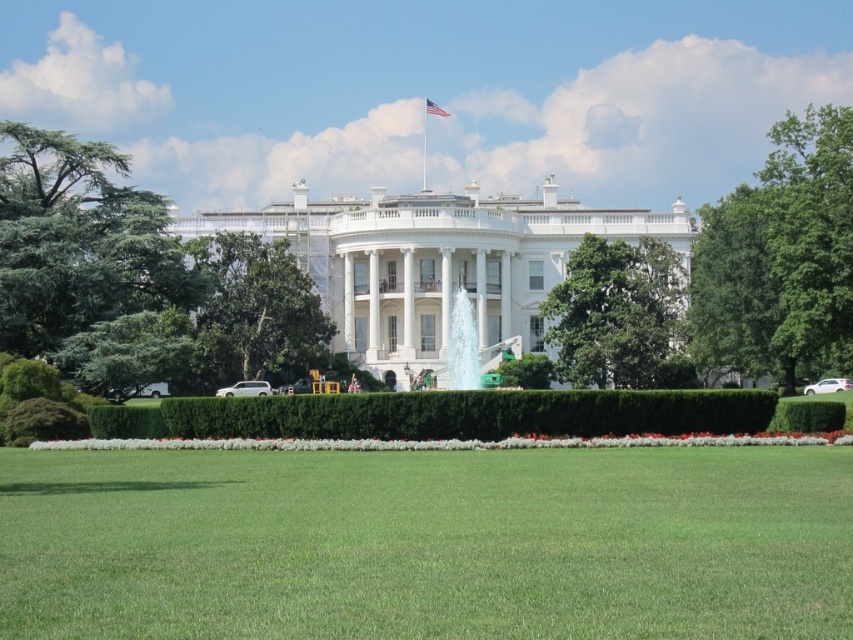
Identify the location of green leafy tree at center. Image resolution: width=853 pixels, height=640 pixels. (254, 308).

Looking at this image, is green leafy tree at center in front of american flag at upper center?

That is True.

Is point (210, 298) positioned after point (440, 115)?

No, it is in front of (440, 115).

Where is `green leafy tree at center`? green leafy tree at center is located at coordinates click(254, 308).

Can you confirm if green leafy tree at upper right is bigger than green leafy tree at center?

Correct, green leafy tree at upper right is larger in size than green leafy tree at center.

What are the coordinates of `green leafy tree at upper right` in the screenshot? It's located at (780, 259).

Find the location of a particular element. Image resolution: width=853 pixels, height=640 pixels. green leafy tree at upper right is located at coordinates (780, 259).

Between point (113, 348) and point (225, 344), which one is positioned behind?

Positioned behind is point (225, 344).

Is green leafy tree at left above green leafy tree at center?

Yes.

Between point (91, 264) and point (248, 371), which one is positioned in front?

Point (91, 264) is in front.

Where is `green leafy tree at left`? green leafy tree at left is located at coordinates (83, 257).